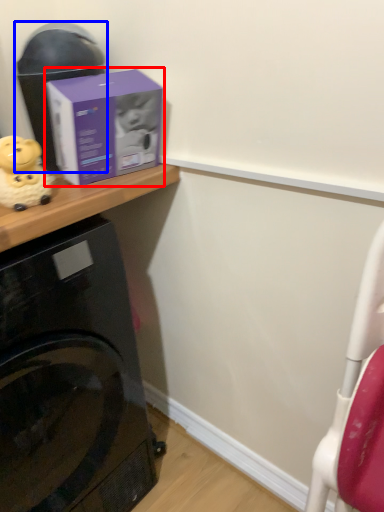
Question: Which object is further to the camera taking this photo, box (highlighted by a red box) or appliance (highlighted by a blue box)?

Choices:
 (A) box
 (B) appliance

Answer: (B)